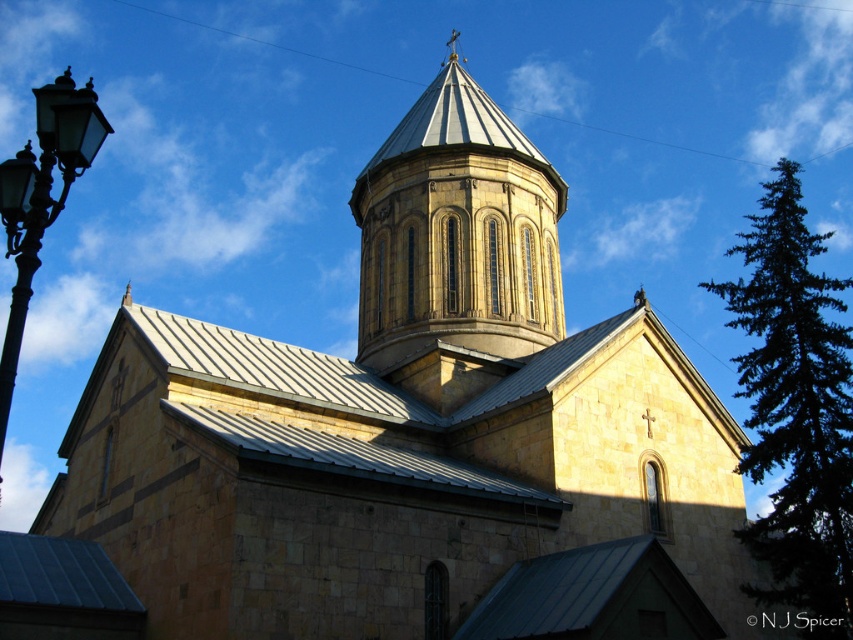
You are a drone operator tasked with capturing aerial footage of the golden stone tower at center and the dark green coniferous tree at right. Your drone has a maximum flight range of 40 meters. Can your drone reach both locations from the same takeoff point without exceeding its range?

The golden stone tower at center is 38.27 meters from the dark green coniferous tree at right. Since the distance between them is within the drone operator drone maximum flight range of 40 meters, the drone can reach both locations from the same takeoff point without exceeding its range.

You are standing in front of the church and want to take a photo that includes both the dark green coniferous tree at right and the black glass streetlight at left. Based on their positions, which object should you position on the right side of your camera frame?

The dark green coniferous tree at right should be positioned on the right side of your camera frame since it is located to the right of the black glass streetlight at left.

You are standing in front of the church and want to take a photo of the golden stone tower at center without the dark green coniferous tree at right blocking the view. Is it possible to position yourself in such a way that the tree is not visible in the frame?

The dark green coniferous tree at right is behind the golden stone tower at center, so if you position yourself in front of the tower, the tree will be hidden behind it and won t appear in the photo.